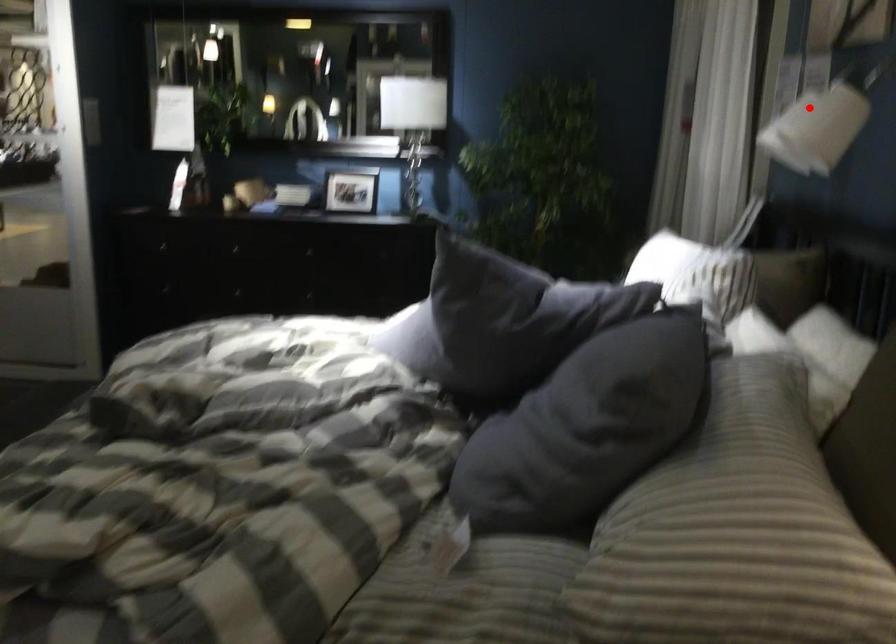
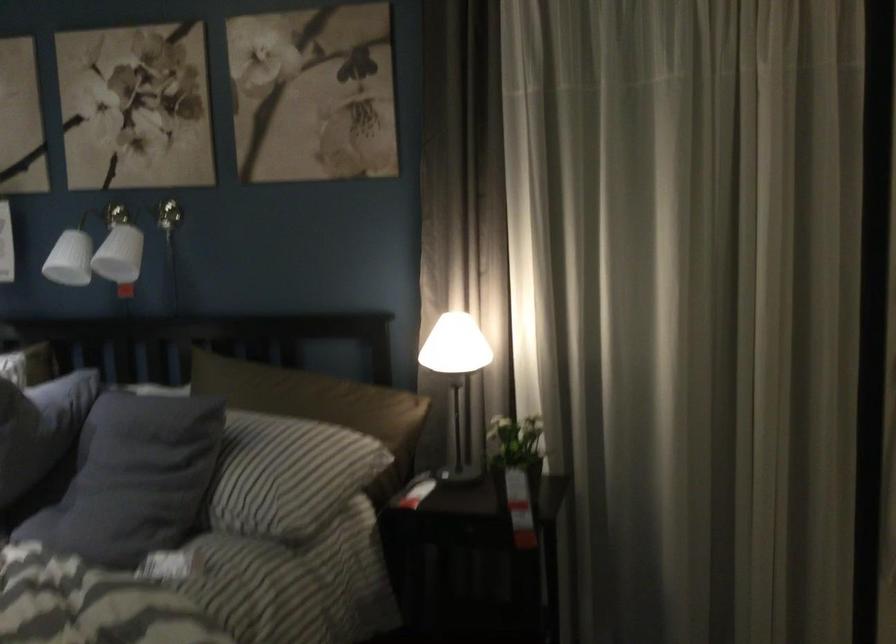
Find the pixel in the second image that matches the highlighted location in the first image.

(125, 245)